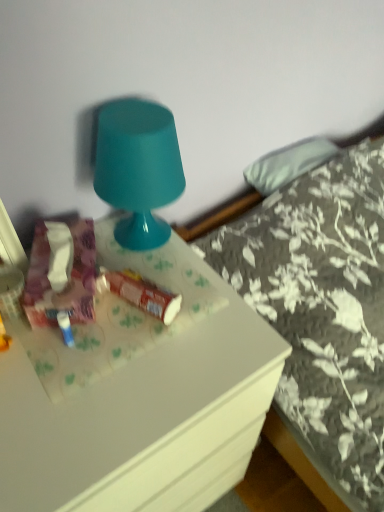
Question: From a real-world perspective, is floral fabric bed at upper right positioned above or below matte floral tissue box at left, the second stuff from the right?

Choices:
 (A) below
 (B) above

Answer: (A)

Question: Which is correct: floral fabric bed at upper right is inside matte floral tissue box at left, the second stuff from the right, or outside of it?

Choices:
 (A) outside
 (B) inside

Answer: (A)

Question: Which of these objects is positioned closest to the glossy plastic lamp at upper center?

Choices:
 (A) white glossy desk at center
 (B) floral fabric bed at upper right
 (C) matte floral tissue box at left, which appears as the 1th stuff when viewed from the left
 (D) matte plastic tube at center, arranged as the first stuff when viewed from the right

Answer: (C)

Question: Estimate the real-world distances between objects in this image. Which object is farther from the matte plastic tube at center, arranged as the first stuff when viewed from the right?

Choices:
 (A) floral fabric bed at upper right
 (B) matte floral tissue box at left, which appears as the 1th stuff when viewed from the left
 (C) glossy plastic lamp at upper center
 (D) white glossy desk at center

Answer: (A)